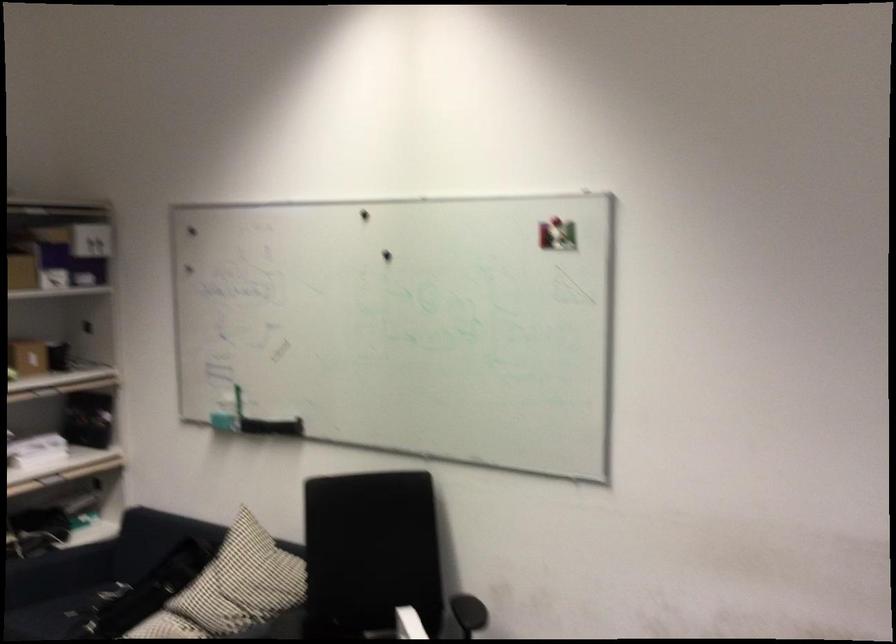
Image resolution: width=896 pixels, height=644 pixels. What do you see at coordinates (469, 612) in the screenshot?
I see `a chair armrest` at bounding box center [469, 612].